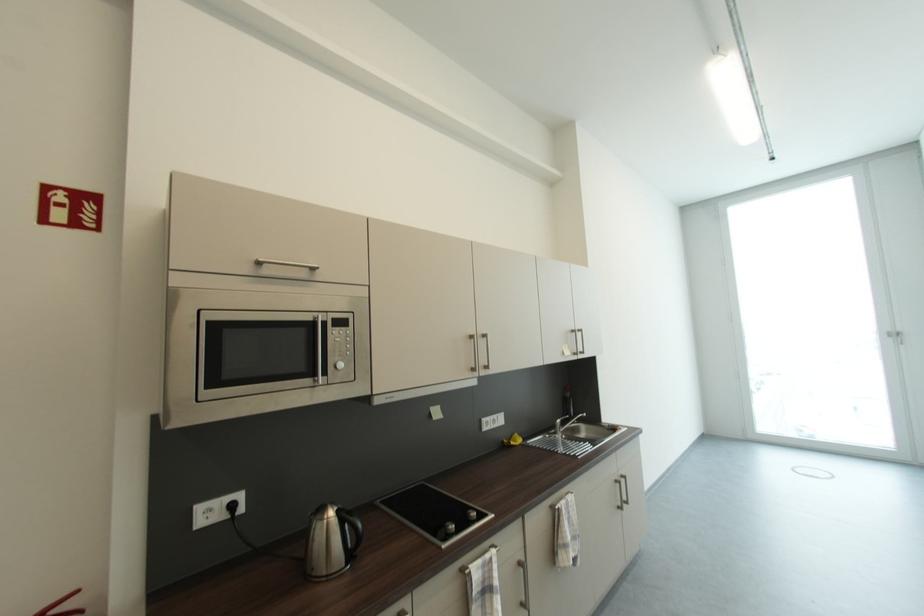
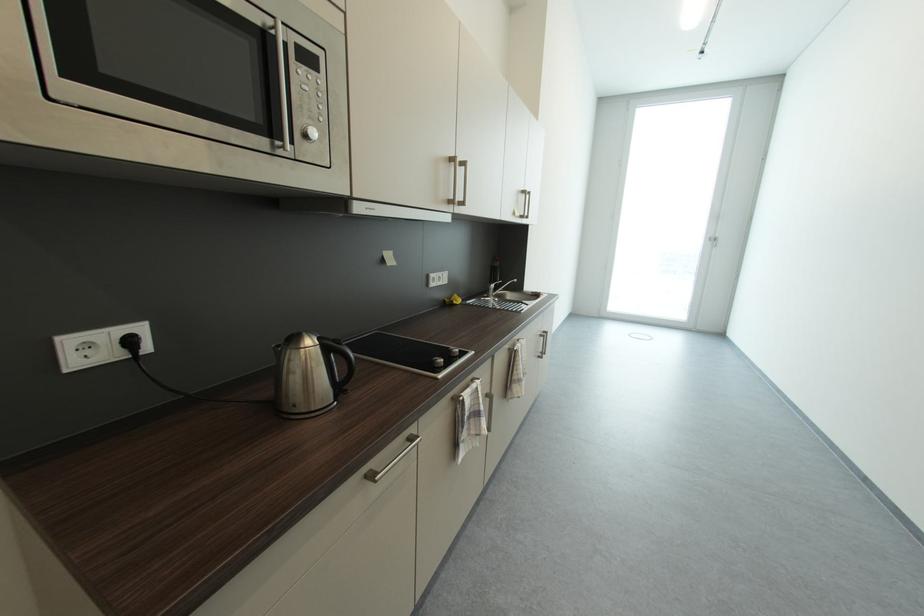
Locate, in the second image, the point that corresponds to the point at 345,341 in the first image.

(313, 89)